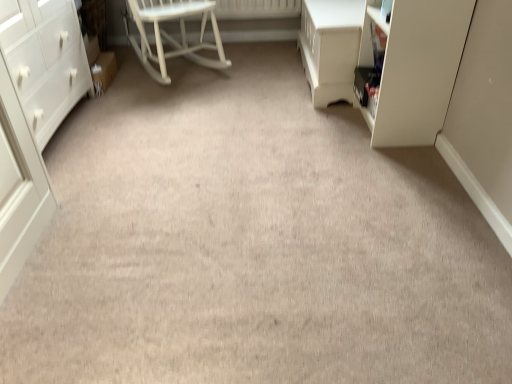
Question: Is matte white cabinet at right wider or thinner than white glossy vanity at upper right?

Choices:
 (A) wide
 (B) thin

Answer: (B)

Question: Would you say matte white cabinet at right is inside or outside white glossy vanity at upper right?

Choices:
 (A) outside
 (B) inside

Answer: (A)

Question: Which is nearer to the white matte chest of drawers at left?

Choices:
 (A) white wood rocking chair at center
 (B) matte white cabinet at right
 (C) white glossy vanity at upper right

Answer: (A)

Question: Which of these objects is positioned farthest from the white glossy vanity at upper right?

Choices:
 (A) white wood rocking chair at center
 (B) matte white cabinet at right
 (C) white matte chest of drawers at left

Answer: (C)